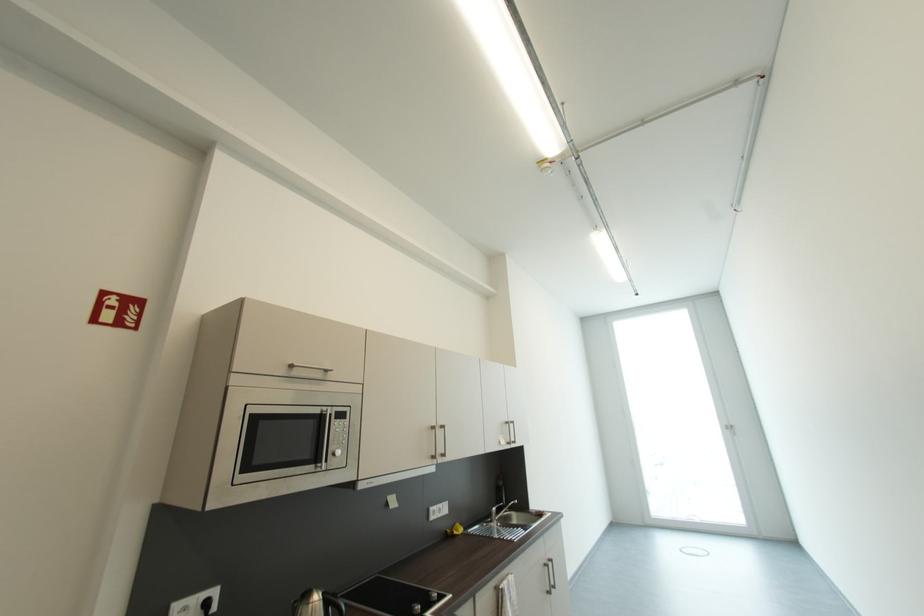
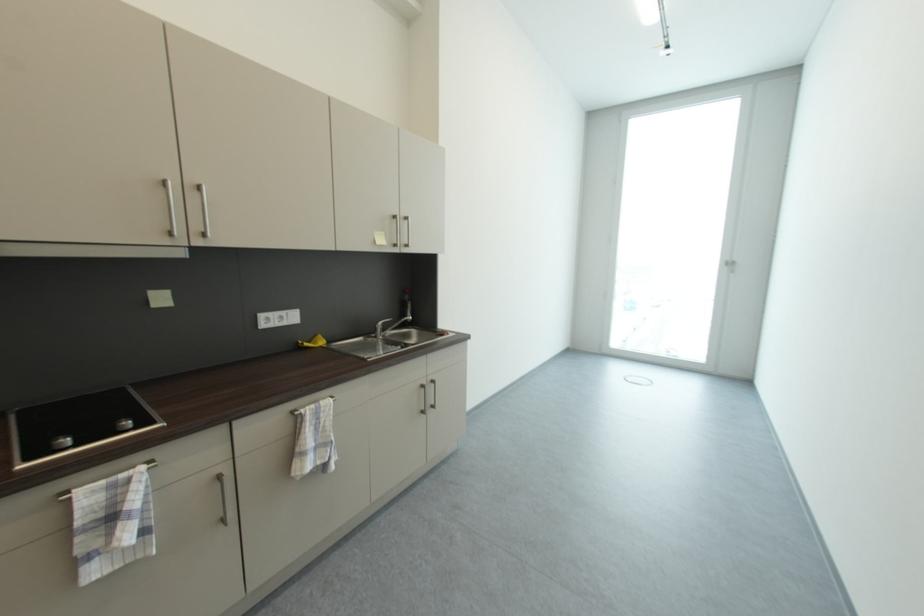
In a continuous first-person perspective shot, in which direction is the camera moving?

The cameraman moved toward right, forward.